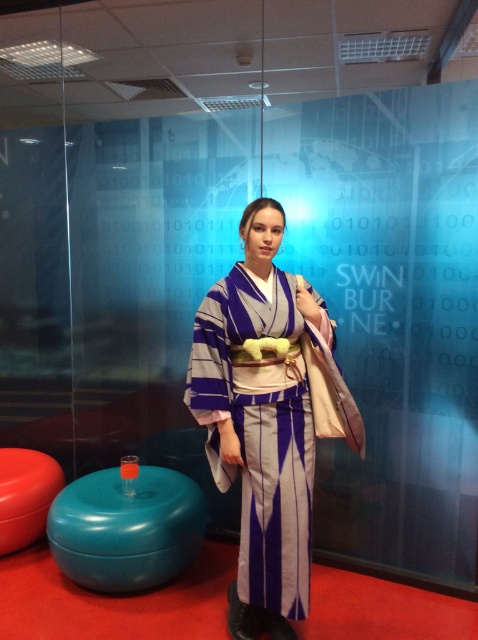
You are a photographer setting up a shoot in this scene. You need to position a camera on the floor between the teal glossy stool at lower left and the matte red stool at lower left. Which stool should you place the camera closer to if you want it to be nearer to the foreground?

The teal glossy stool at lower left is in front of the matte red stool at lower left, so placing the camera closer to the teal glossy stool at lower left will position it nearer to the foreground.

You are a photographer trying to capture the best shot of the scene. You need to ensure that both the point at (310,305) and the point at (117,541) are clearly visible in your photo. Based on their positions, which point should be closer to the camera?

Point (310,305) is in front of point (117,541), so it is closer to the camera.

You are an interior designer assessing the space in the image. The silky purple kimono at center and the matte red stool at lower left are both in the room. Which object is taller?

The silky purple kimono at center is taller than the matte red stool at lower left.